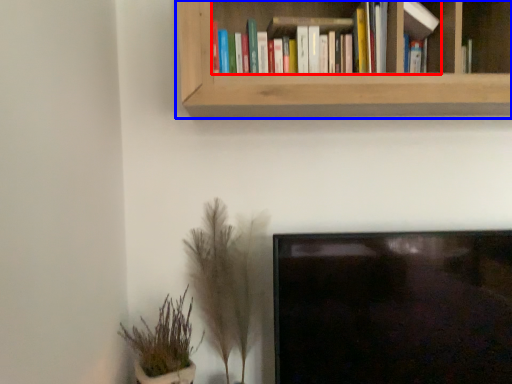
Question: Among these objects, which one is farthest to the camera, book (highlighted by a red box) or bookcase (highlighted by a blue box)?

Choices:
 (A) book
 (B) bookcase

Answer: (A)